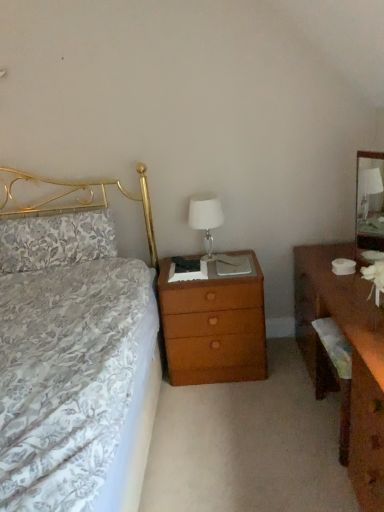
Question: Considering the relative positions of clear glass mirror at right and floral fabric pillow at left in the image provided, is clear glass mirror at right to the right of floral fabric pillow at left from the viewer's perspective?

Choices:
 (A) yes
 (B) no

Answer: (A)

Question: Is clear glass mirror at right behind floral fabric pillow at left?

Choices:
 (A) yes
 (B) no

Answer: (B)

Question: Can we say clear glass mirror at right lies outside floral fabric pillow at left?

Choices:
 (A) no
 (B) yes

Answer: (B)

Question: Does clear glass mirror at right turn towards floral fabric pillow at left?

Choices:
 (A) no
 (B) yes

Answer: (B)

Question: Is clear glass mirror at right taller than floral fabric pillow at left?

Choices:
 (A) yes
 (B) no

Answer: (A)

Question: Does clear glass mirror at right lie in front of floral fabric pillow at left?

Choices:
 (A) yes
 (B) no

Answer: (A)

Question: Is brown wood nightstand at center smaller than white glass lampshade at center?

Choices:
 (A) yes
 (B) no

Answer: (B)

Question: Is brown wood nightstand at center not within white glass lampshade at center?

Choices:
 (A) no
 (B) yes

Answer: (B)

Question: Is brown wood nightstand at center oriented towards white glass lampshade at center?

Choices:
 (A) no
 (B) yes

Answer: (A)

Question: Is brown wood nightstand at center next to white glass lampshade at center and touching it?

Choices:
 (A) yes
 (B) no

Answer: (B)

Question: Is brown wood nightstand at center to the left of white glass lampshade at center from the viewer's perspective?

Choices:
 (A) no
 (B) yes

Answer: (A)

Question: From the image's perspective, is brown wood nightstand at center above white glass lampshade at center?

Choices:
 (A) no
 (B) yes

Answer: (A)

Question: Is wooden desk at right outside floral fabric pillow at left?

Choices:
 (A) no
 (B) yes

Answer: (B)